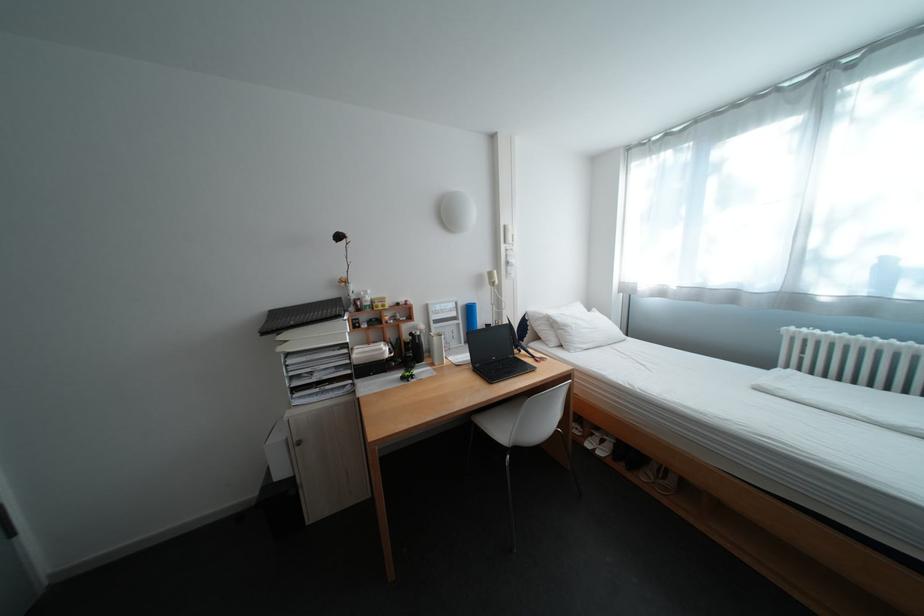
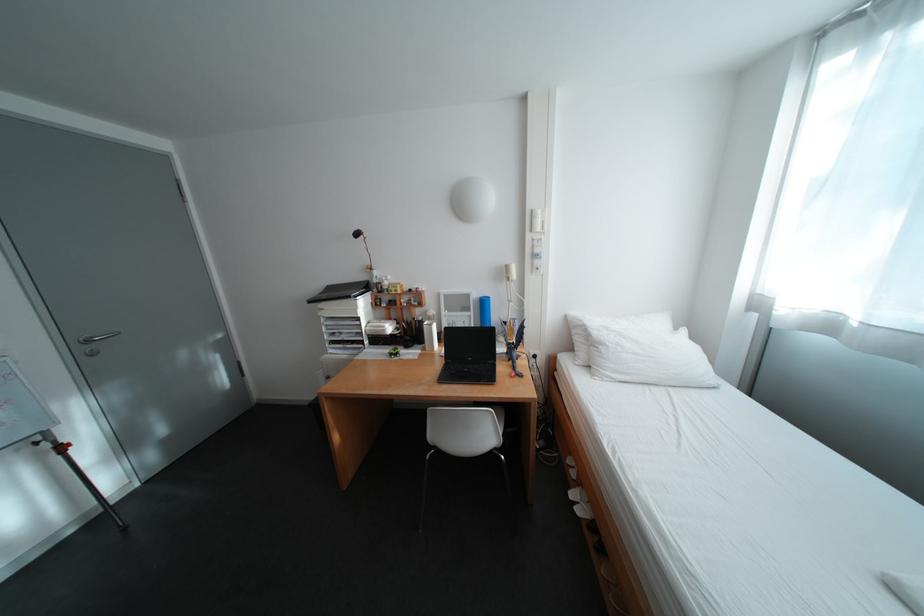
Where in the second image is the point corresponding to [472,322] from the first image?

(484, 314)